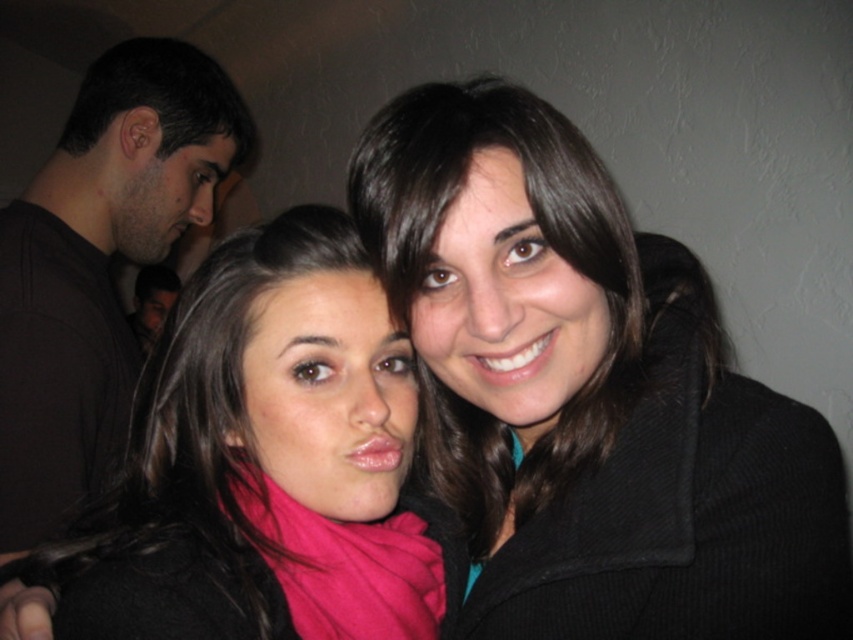
You are organizing a photo shoot and need to ensure that the pink fabric scarf at center and the black matte shirt at left are both visible in the frame. Given their sizes, which object might you need to adjust the camera angle to ensure it doesn not get obscured?

The pink fabric scarf at center occupies less space than the black matte shirt at left, so you might need to adjust the camera angle to ensure the smaller pink fabric scarf at center is not obscured by the larger black matte shirt at left.

You are at a party and need to hand a gift to the person wearing the black matte shirt at left. You are standing behind the black woolen coat at center. Can you directly hand the gift to them without moving around the coat?

The black woolen coat at center is closer to the viewer than the black matte shirt at left, so you cannot directly hand the gift to the person wearing the black matte shirt at left without moving around the coat.

In the image, there are two people and a black woolen coat at center represented by point (589, 392). Which person is closer to the black woolen coat at center?

The black woolen coat at center is represented by point (589, 392). Since the person on the left is positioned closer to the center of the image than the person on the right, the person on the left is closer to the black woolen coat at center.